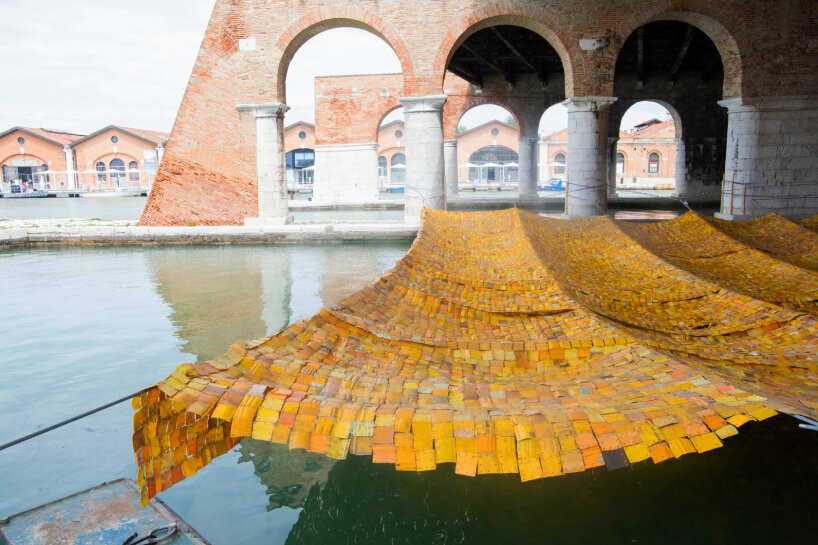
Locate an element on the screen. white paint is located at coordinates (268, 131), (428, 119), (331, 174), (762, 152).